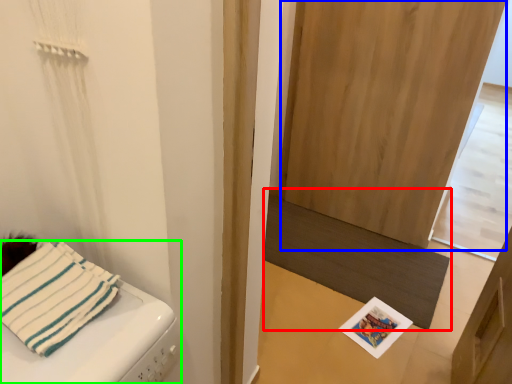
Question: Which object is the closest to the mat (highlighted by a red box)? Choose among these: screen door (highlighted by a blue box) or furniture (highlighted by a green box).

Choices:
 (A) screen door
 (B) furniture

Answer: (A)